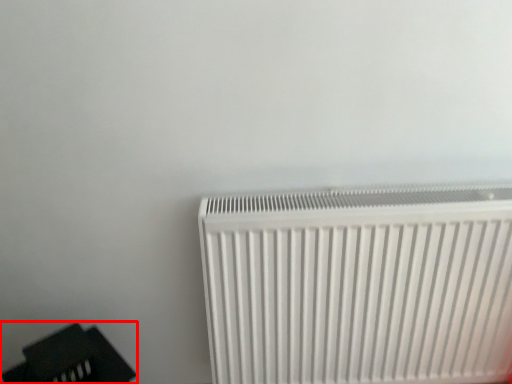
Question: From the image's perspective, where is furniture (annotated by the red box) located in relation to radiator in the image?

Choices:
 (A) above
 (B) below

Answer: (B)